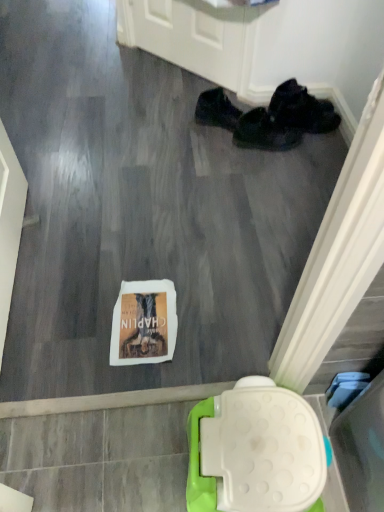
Where is `free space to the left of black fabric shoes at center, the second footwear positioned from the left`? The width and height of the screenshot is (384, 512). free space to the left of black fabric shoes at center, the second footwear positioned from the left is located at coordinates (208, 148).